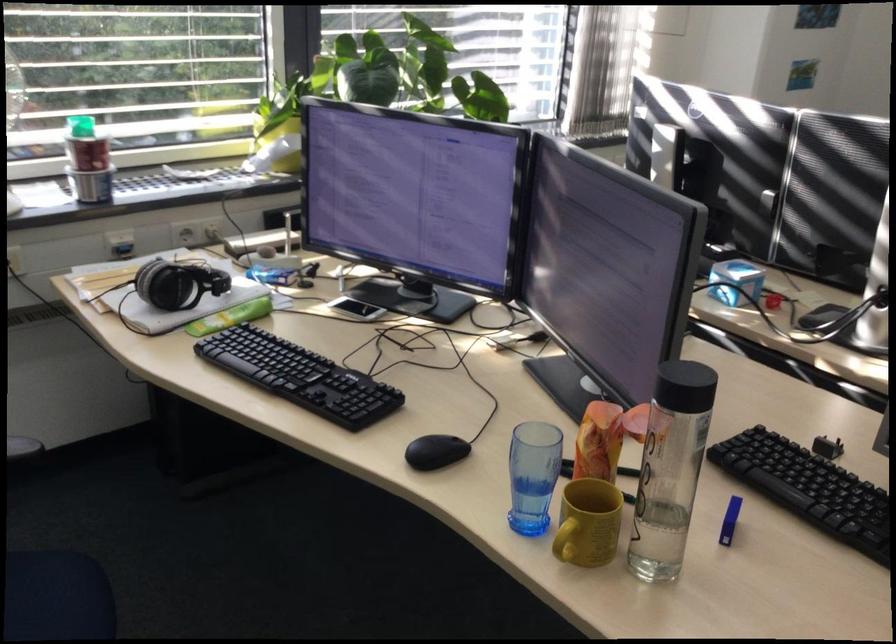
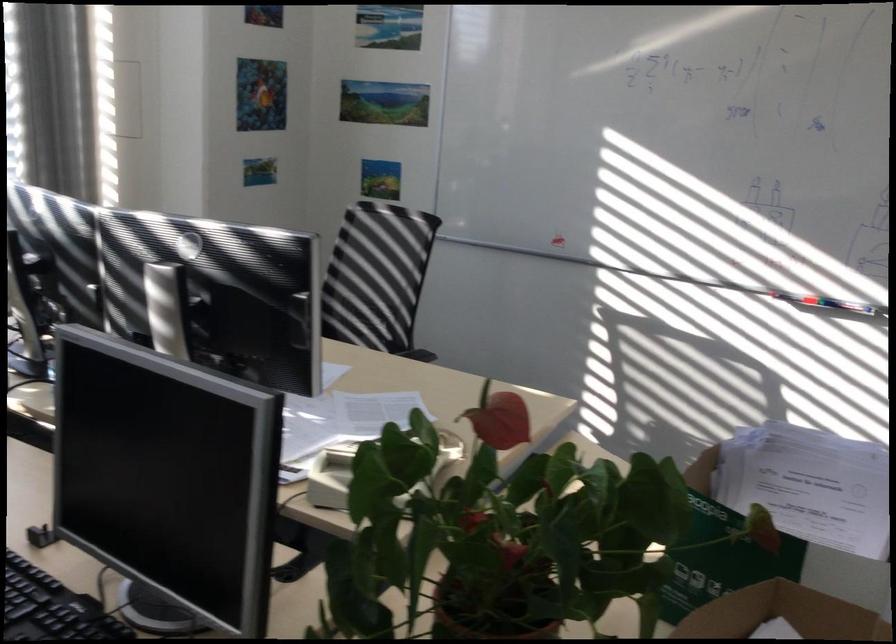
Question: The first image is from the beginning of the video and the second image is from the end. How did the camera likely rotate when shooting the video?

Choices:
 (A) Left
 (B) Right
 (C) Up
 (D) Down

Answer: (B)